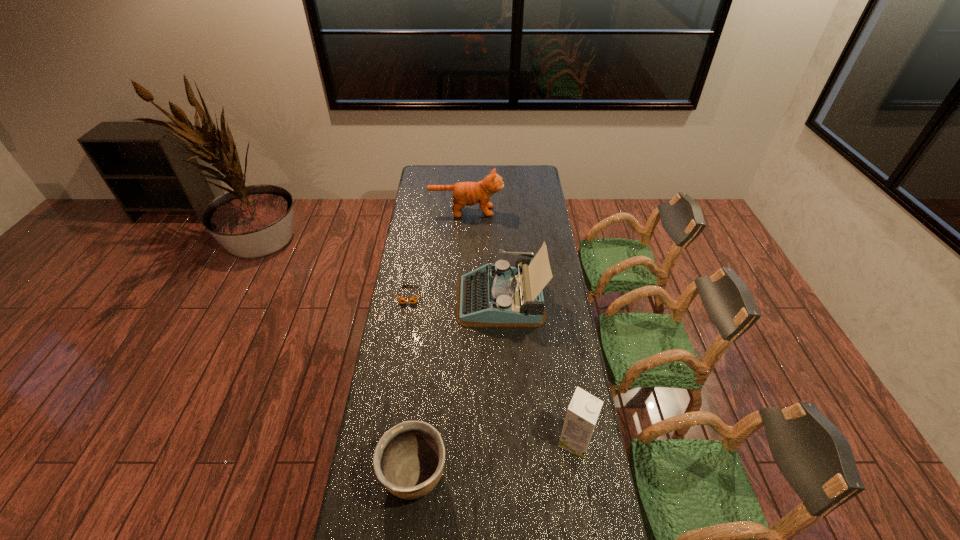
Identify the location of free location located on the right of the pottery. Image resolution: width=960 pixels, height=540 pixels. (535, 476).

Identify the location of vacant space located 0.290m with the lenses facing forward on the shortest object. The height and width of the screenshot is (540, 960). (399, 358).

Image resolution: width=960 pixels, height=540 pixels. Find the location of `cat that is at the left edge`. cat that is at the left edge is located at coordinates (x=464, y=193).

Where is `pottery that is positioned at the left edge`? The height and width of the screenshot is (540, 960). pottery that is positioned at the left edge is located at coordinates click(409, 458).

At what (x,y) coordinates should I click in order to perform the action: click on goggles located at the left edge. Please return your answer as a coordinate pair (x, y). This screenshot has height=540, width=960. Looking at the image, I should click on (401, 299).

In order to click on typewriter that is at the right edge in this screenshot , I will do `click(494, 295)`.

The image size is (960, 540). What are the coordinates of `carton located in the right edge section of the desktop` in the screenshot? It's located at (583, 411).

What are the coordinates of `free point at the far edge` in the screenshot? It's located at (447, 177).

Where is `vacant area at the left edge`? The height and width of the screenshot is (540, 960). vacant area at the left edge is located at coordinates (423, 262).

Where is `free space at the right edge of the desktop`? Image resolution: width=960 pixels, height=540 pixels. free space at the right edge of the desktop is located at coordinates (570, 384).